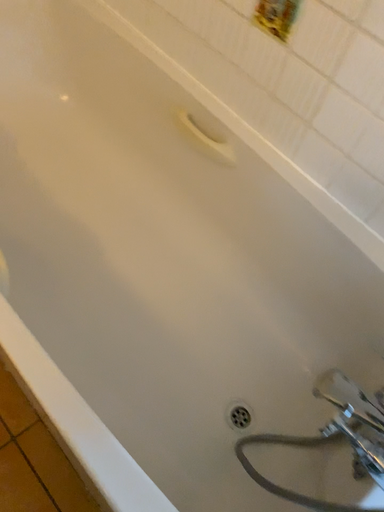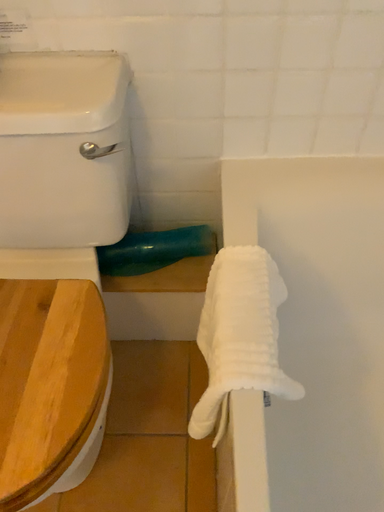
Question: Which way did the camera rotate in the video?

Choices:
 (A) rotated downward
 (B) rotated upward

Answer: (B)